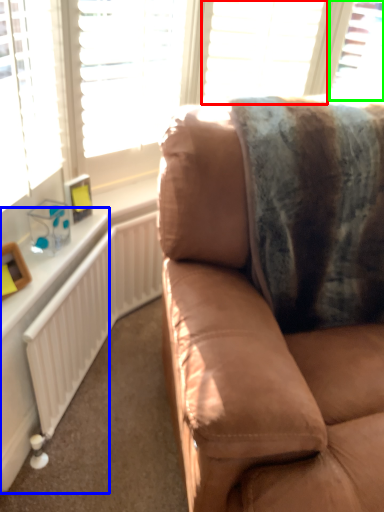
Question: Which object is positioned closest to blind (highlighted by a red box)? Select from table (highlighted by a blue box) and window (highlighted by a green box).

Choices:
 (A) table
 (B) window

Answer: (B)